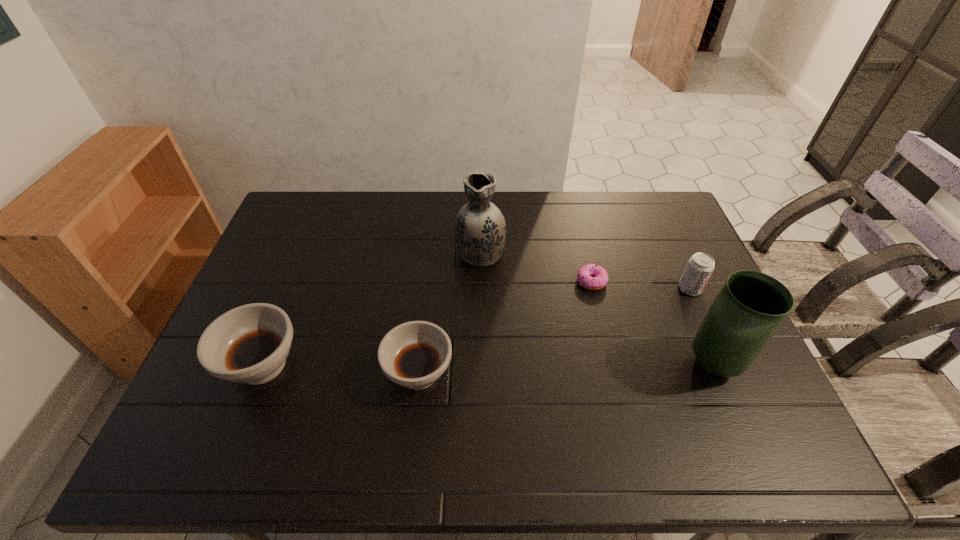
Please point out where to position a new soup bowl on the right to maintain spacing. Please provide its 2D coordinates. Your answer should be formatted as a tuple, i.e. [(x, y)], where the tuple contains the x and y coordinates of a point satisfying the conditions above.

[(580, 381)]